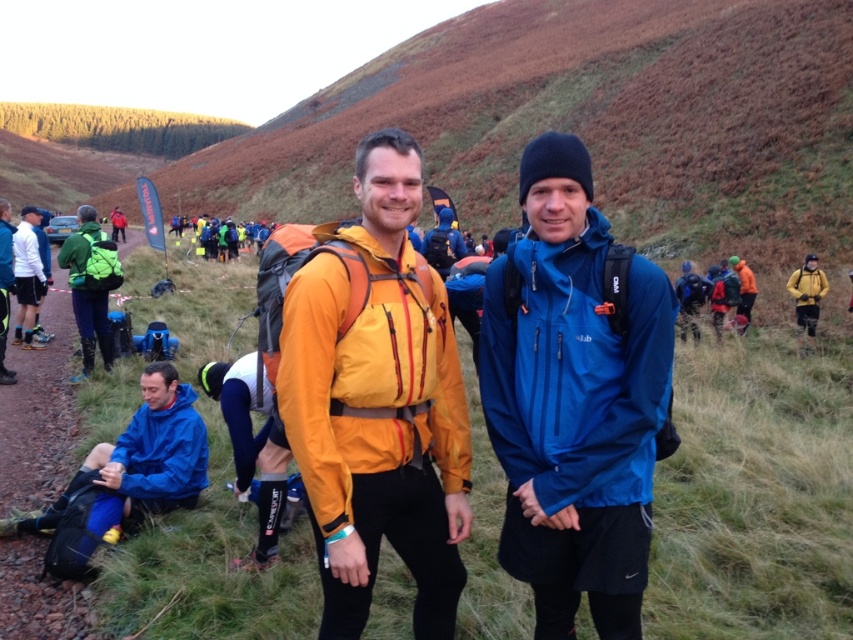
You are organizing a hiking event and need to ensure visibility. The participants have two jackets available for visibility testing. Which jacket, the matte yellow jacket at center or the blue matte jacket at lower left, would be more visible against the grassy hillside with brownish red vegetation?

The matte yellow jacket at center would be more visible against the grassy hillside with brownish red vegetation because its color contrasts more with the background compared to the blue matte jacket at lower left.

You are organizing a hiking event and need to ensure participants have jackets that can accommodate layers underneath. If the blue waterproof jacket at center is narrower than the matte yellow jacket at center, which jacket would allow for more layering underneath?

The matte yellow jacket at center allows for more layering underneath because it is wider than the blue waterproof jacket at center.

You are a photographer trying to capture a photo of both the blue waterproof jacket at center and the matte yellow jacket at center. Which jacket should you focus on first to ensure both are in the frame?

You should focus on the blue waterproof jacket at center first because it is closer to you than the matte yellow jacket at center, ensuring both are in the frame.